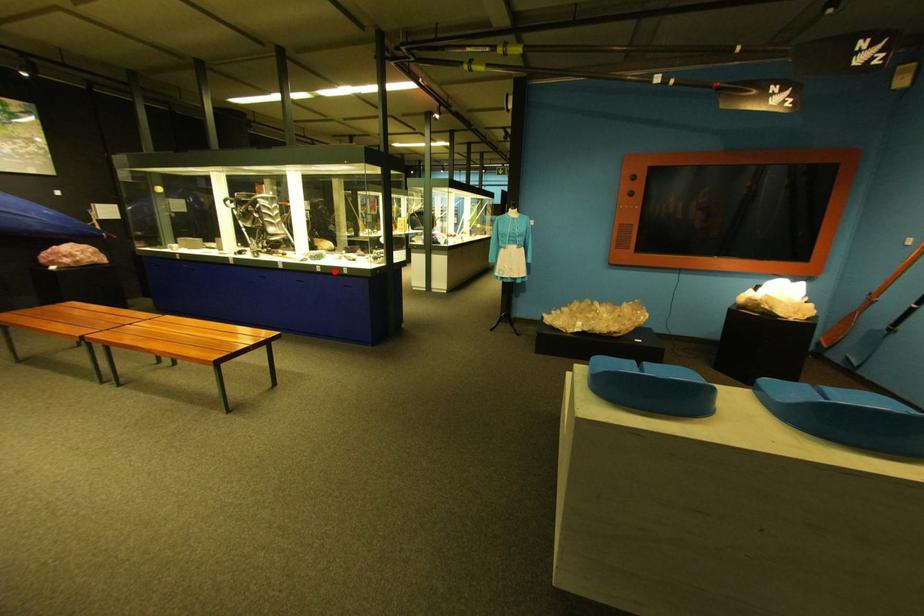
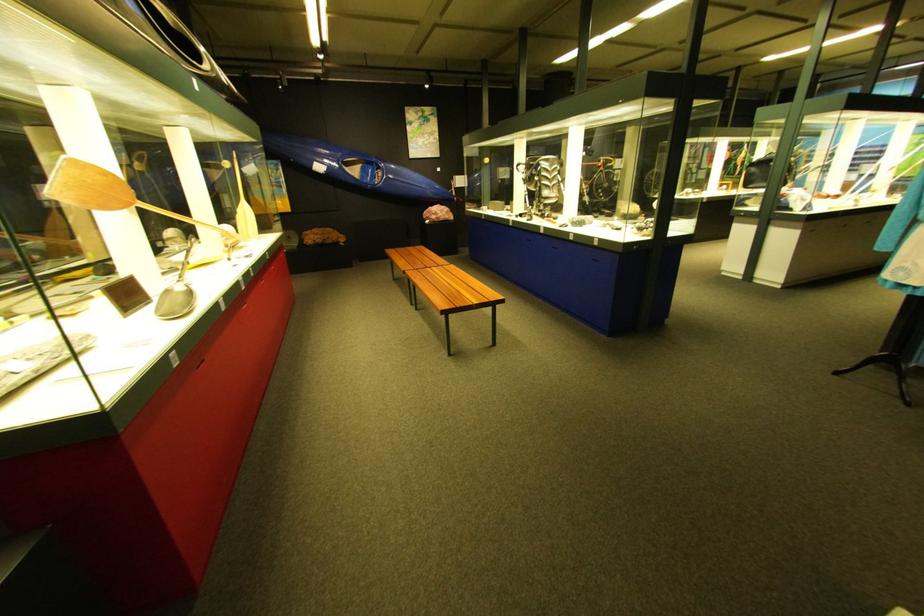
Question: A red point is marked in image1. In image2, is the corresponding 3D point closer to the camera or farther? Reply with the corresponding letter.

Choices:
 (A) The corresponding 3D point is closer.
 (B) The corresponding 3D point is farther.

Answer: (A)